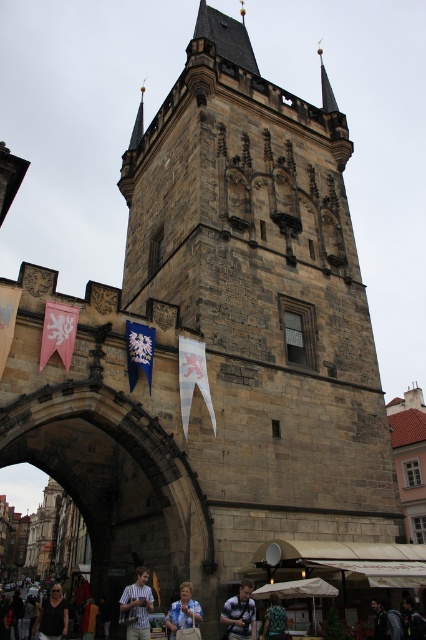
You are standing at the base of the historic stone tower and see the blue fabric flag at center and the dark blue backpack at center. From your perspective, which object is positioned to the left?

The blue fabric flag at center is to the left of the dark blue backpack at center.